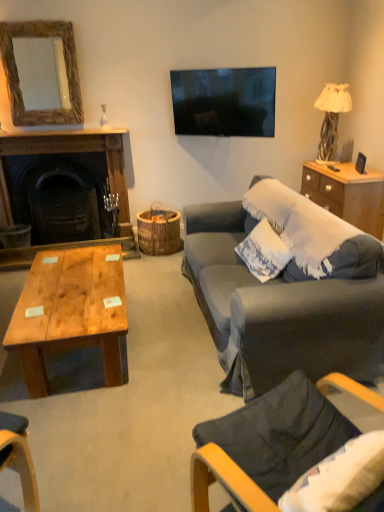
Question: Visually, is dark gray fabric chair at lower right positioned to the left or to the right of dark wood fireplace at left?

Choices:
 (A) right
 (B) left

Answer: (A)

Question: Is point (319, 399) closer or farther from the camera than point (117, 151)?

Choices:
 (A) closer
 (B) farther

Answer: (A)

Question: Estimate the real-world distances between objects in this image. Which object is closer to the dark wood fireplace at left?

Choices:
 (A) black plastic remote control at right
 (B) wooden frame mirror at upper left
 (C) wooden cabinet at right
 (D) white textured pillow at right
 (E) metallic silver picture frame at right

Answer: (B)

Question: Considering the real-world distances, which object is closest to the wooden coffee table at center?

Choices:
 (A) metallic silver picture frame at right
 (B) wooden cabinet at right
 (C) black plastic remote control at right
 (D) dark wood fireplace at left
 (E) dark gray fabric chair at lower right

Answer: (E)